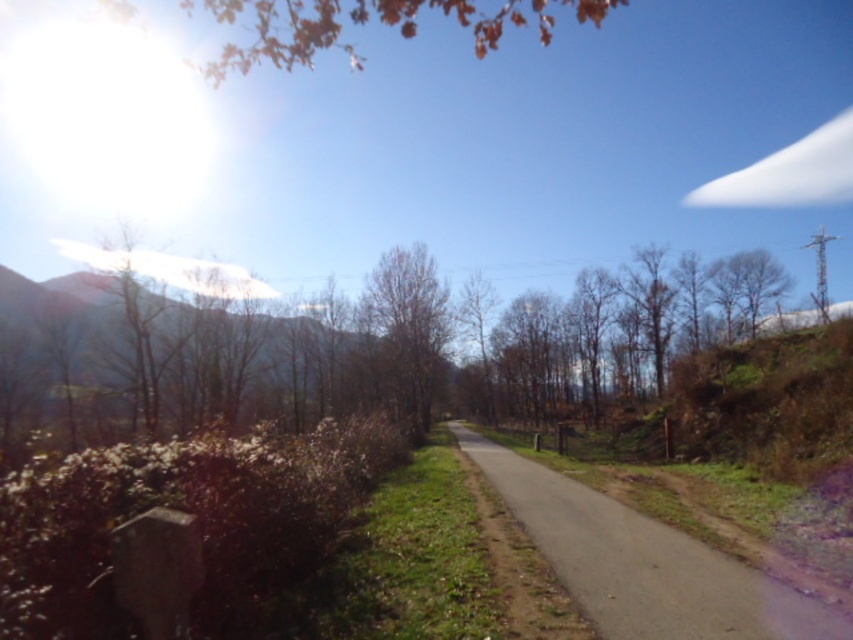
You are standing on the paved path in the rural scene and want to walk from the brown textured mountain at left to the brown leafless tree at center. How far will you have to walk?

The distance between the brown textured mountain at left and the brown leafless tree at center is 11.96 meters, so you will have to walk 11.96 meters.

You are a hiker planning to take a photo of the gray asphalt road at center and the brown textured mountain at left. Which object should you focus on first if you want both to be in sharp focus?

The gray asphalt road at center has a lesser height compared to the brown textured mountain at left, so you should focus on the brown textured mountain at left first to ensure both are in sharp focus.